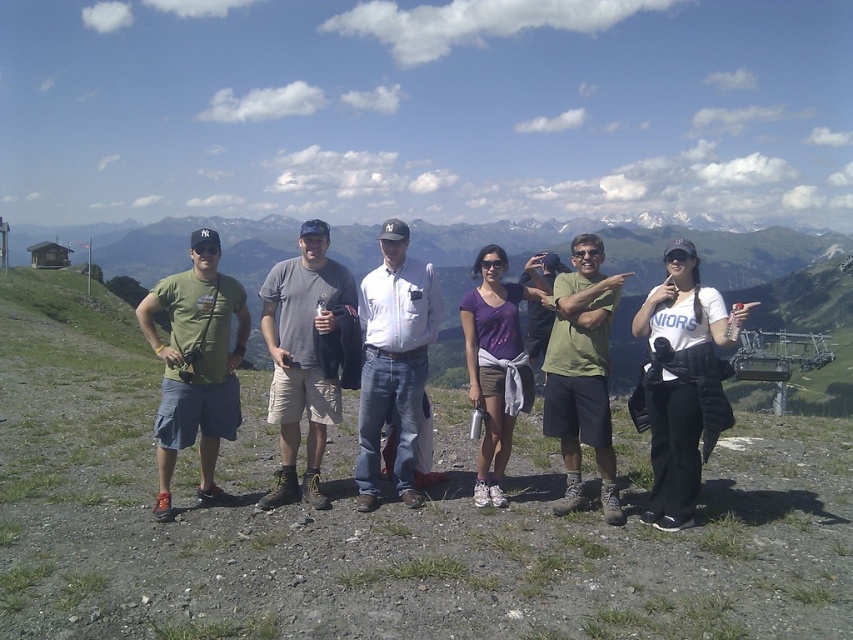
You are a photographer trying to capture a group photo of the white matte shirt at center and the gray fabric shirt at center. Based on their positions, which one do you think is more to the left?

The white matte shirt at center might be wider than gray fabric shirt at center, but this does not indicate their left or right positioning. Without specific spatial information about their horizontal positions, it is impossible to determine which is more to the left.

You are standing at the point labeled point (271, 320) and want to move towards the point labeled point (691, 451). Which direction should you face to walk towards it?

You should face towards the point (691, 451) because it is closer to the viewer than point (271, 320), so it is located in front of you.